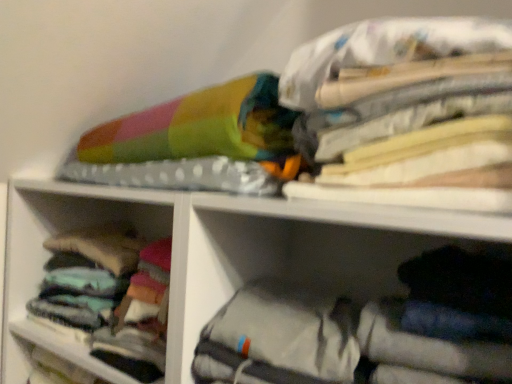
Question: Is multicolored fabric at upper right beside soft cotton socks at left, the 1th cabinet viewed from the back?

Choices:
 (A) yes
 (B) no

Answer: (B)

Question: From a real-world perspective, is multicolored fabric at upper right located higher than soft cotton socks at left, the 1th cabinet viewed from the back?

Choices:
 (A) yes
 (B) no

Answer: (A)

Question: Does multicolored fabric at upper right have a lesser height compared to soft cotton socks at left, the 1th cabinet viewed from the back?

Choices:
 (A) yes
 (B) no

Answer: (B)

Question: Is multicolored fabric at upper right not within soft cotton socks at left, placed as the 2th cabinet when sorted from right to left?

Choices:
 (A) no
 (B) yes

Answer: (B)

Question: Is multicolored fabric at upper right at the right side of soft cotton socks at left, arranged as the 2th cabinet when viewed from the front?

Choices:
 (A) yes
 (B) no

Answer: (A)

Question: From a real-world perspective, is multicolored fabric at upper right located beneath soft cotton socks at left, the 1th cabinet viewed from the back?

Choices:
 (A) no
 (B) yes

Answer: (A)

Question: From a real-world perspective, is soft cotton socks at left, placed as the 2th cabinet when sorted from right to left, on top of multicolored fabric at upper right?

Choices:
 (A) yes
 (B) no

Answer: (B)

Question: Is soft cotton socks at left, the first cabinet positioned from the left, facing away from multicolored fabric at upper right?

Choices:
 (A) yes
 (B) no

Answer: (B)

Question: Can you confirm if soft cotton socks at left, the 1th cabinet viewed from the back, is positioned to the left of multicolored fabric at upper right?

Choices:
 (A) no
 (B) yes

Answer: (B)

Question: Is soft cotton socks at left, placed as the 2th cabinet when sorted from right to left, shorter than multicolored fabric at upper right?

Choices:
 (A) yes
 (B) no

Answer: (A)

Question: Can you confirm if soft cotton socks at left, placed as the 2th cabinet when sorted from right to left, is thinner than multicolored fabric at upper right?

Choices:
 (A) yes
 (B) no

Answer: (B)

Question: Considering the relative sizes of soft cotton socks at left, placed as the 2th cabinet when sorted from right to left, and multicolored fabric at upper right in the image provided, is soft cotton socks at left, placed as the 2th cabinet when sorted from right to left, bigger than multicolored fabric at upper right?

Choices:
 (A) yes
 (B) no

Answer: (A)

Question: Can you confirm if soft cotton socks at left, arranged as the 2th cabinet when viewed from the front, is smaller than gray fabric bag at lower right, the second cabinet from the back?

Choices:
 (A) no
 (B) yes

Answer: (B)